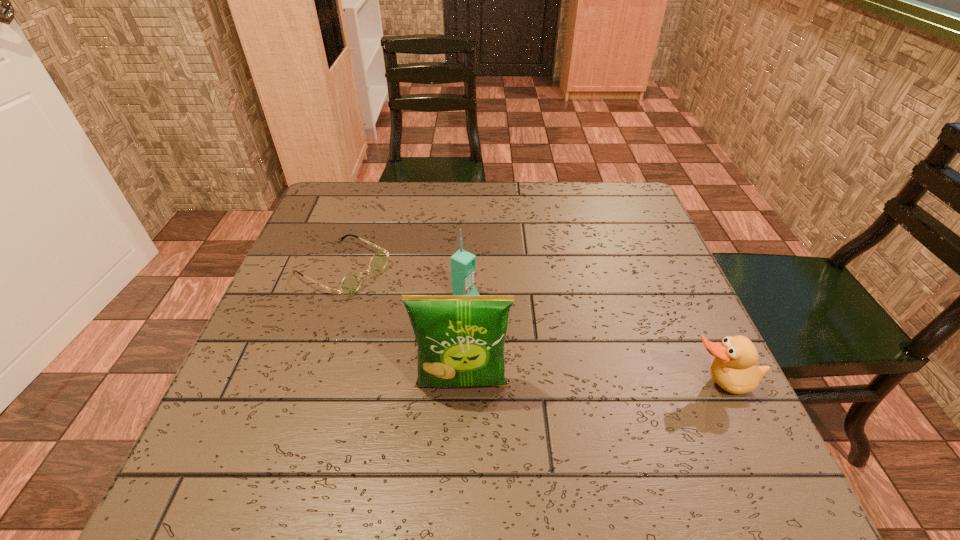
Find the location of a particular element. This screenshot has height=540, width=960. vacant point located between the leftmost object and the rightmost object is located at coordinates [530, 327].

Where is `empty space between the leftmost object and the tallest object`? The width and height of the screenshot is (960, 540). empty space between the leftmost object and the tallest object is located at coordinates (402, 327).

Image resolution: width=960 pixels, height=540 pixels. I want to click on unoccupied area between the tallest object and the third tallest object, so click(590, 385).

Point out which object is positioned as the third nearest to the third shortest object. Please provide its 2D coordinates. Your answer should be formatted as a tuple, i.e. [(x, y)], where the tuple contains the x and y coordinates of a point satisfying the conditions above.

[(733, 369)]

At what (x,y) coordinates should I click in order to perform the action: click on object identified as the closest to the spectacles. Please return your answer as a coordinate pair (x, y). The image size is (960, 540). Looking at the image, I should click on (463, 263).

Where is `vacant point that satisfies the following two spatial constraints: 1. on the front side of the leftmost object; 2. on the left side of the cellular telephone`? Image resolution: width=960 pixels, height=540 pixels. vacant point that satisfies the following two spatial constraints: 1. on the front side of the leftmost object; 2. on the left side of the cellular telephone is located at coordinates (332, 299).